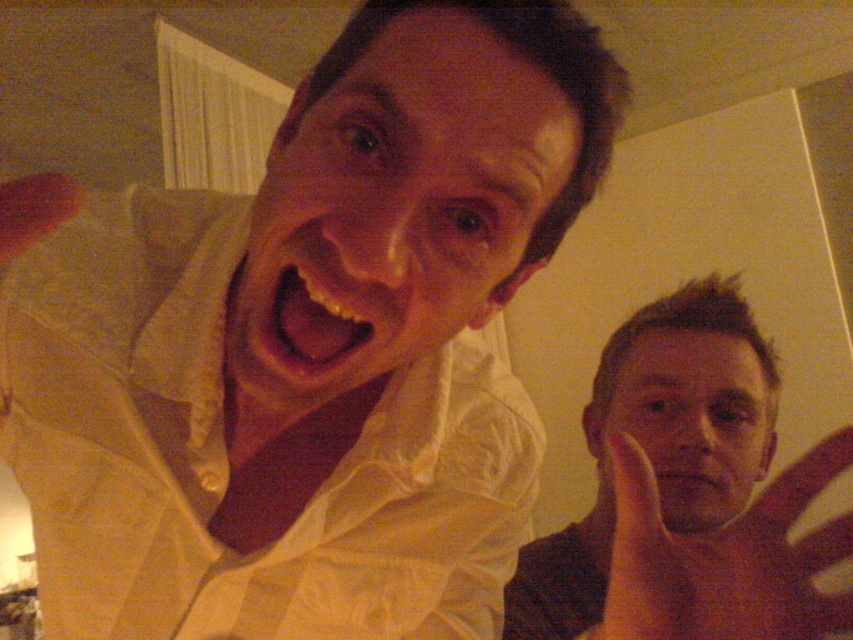
You are standing in the room and want to hand a gift to the person wearing the white glossy shirt at upper left. Based on their position in the image, which direction should you move to approach them?

The white glossy shirt at upper left is located at point (x=310, y=348), so you should move towards the upper left direction to approach them.

You are a photographer trying to capture a clear shot of the matte skin hand at lower right. However, the white glossy shirt at upper left is blocking your view. Can you determine if the hand is completely covered by the shirt?

The white glossy shirt at upper left is positioned over the matte skin hand at lower right, so the hand is completely covered by the shirt.